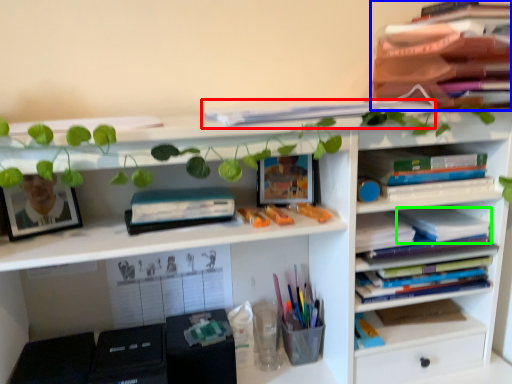
Question: Which object is the closest to the book (highlighted by a red box)? Choose among these: book (highlighted by a blue box) or book (highlighted by a green box).

Choices:
 (A) book
 (B) book

Answer: (A)